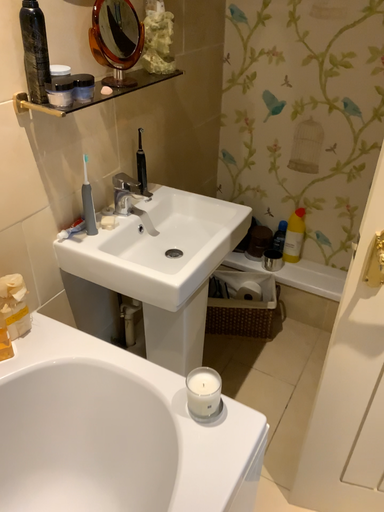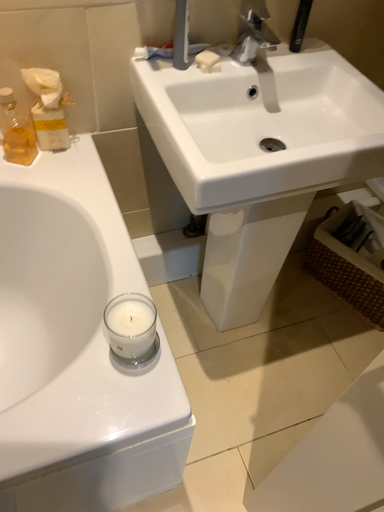
Question: Which way did the camera rotate in the video?

Choices:
 (A) rotated right
 (B) rotated left

Answer: (B)